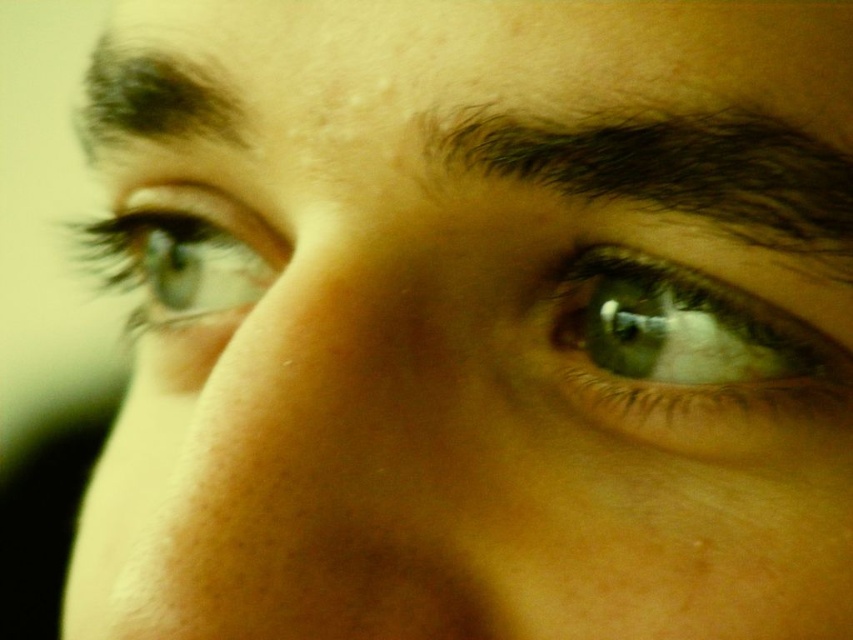
You are a photographer adjusting the lighting for a portrait. You notice two strands of dark brown hair at upper center and dark brown hair at upper left in the frame. Which strand of dark brown hair is wider in the image?

The dark brown hair at upper center might be wider than dark brown hair at upper left according to the description.

You are a photographer adjusting the camera focus. You notice the green matte eye at upper left and the dark brown hair at upper left in your frame. Which object should you focus on to ensure the wider one is sharp?

The green matte eye at upper left is wider than the dark brown hair at upper left, so focus on the green matte eye at upper left to ensure the wider one is sharp.